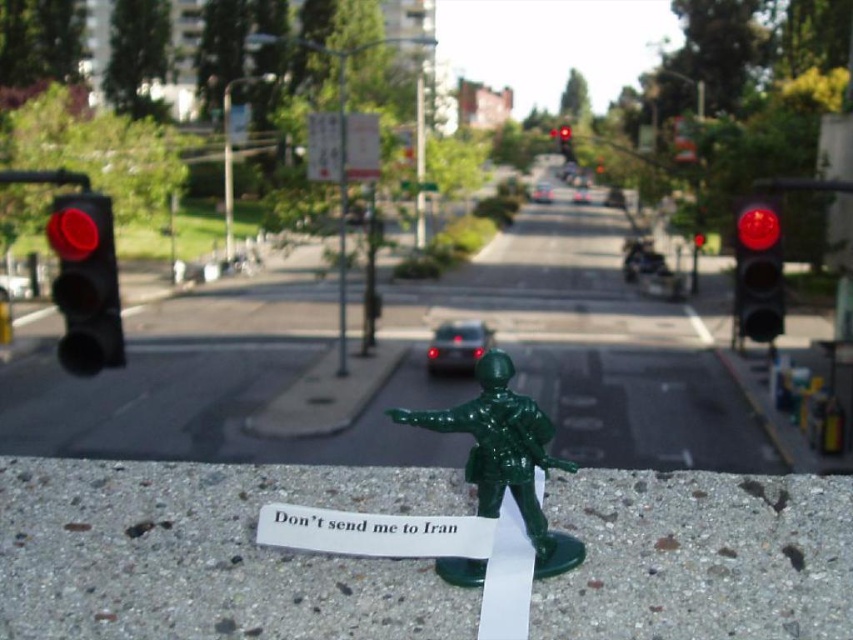
Based on the photo, is red matte traffic light at right thinner than red matte traffic light at center?

No.

Who is more forward, (781, 321) or (563, 148)?

Point (781, 321) is in front.

Where is `red matte traffic light at right`? The image size is (853, 640). red matte traffic light at right is located at coordinates (757, 273).

Is point (90, 284) positioned in front of point (740, 227)?

Yes, point (90, 284) is closer to viewer.

Who is higher up, black matte traffic light at left or red matte traffic light at right?

red matte traffic light at right is higher up.

Describe the element at coordinates (86, 282) in the screenshot. I see `black matte traffic light at left` at that location.

The height and width of the screenshot is (640, 853). Identify the location of black matte traffic light at left. (86, 282).

Can you confirm if black matte traffic light at left is positioned to the left of red matte traffic light at center?

Correct, you'll find black matte traffic light at left to the left of red matte traffic light at center.

From the picture: Between black matte traffic light at left and red matte traffic light at center, which one is positioned lower?

black matte traffic light at left

Who is more forward, (61, 262) or (569, 128)?

Point (61, 262) is more forward.

You are a GUI agent. You are given a task and a screenshot of the screen. Output one action in this format:
    pyautogui.click(x=<x>, y=<y>)
    Task: Click on the black matte traffic light at left
    
    Given the screenshot: What is the action you would take?
    pyautogui.click(x=86, y=282)